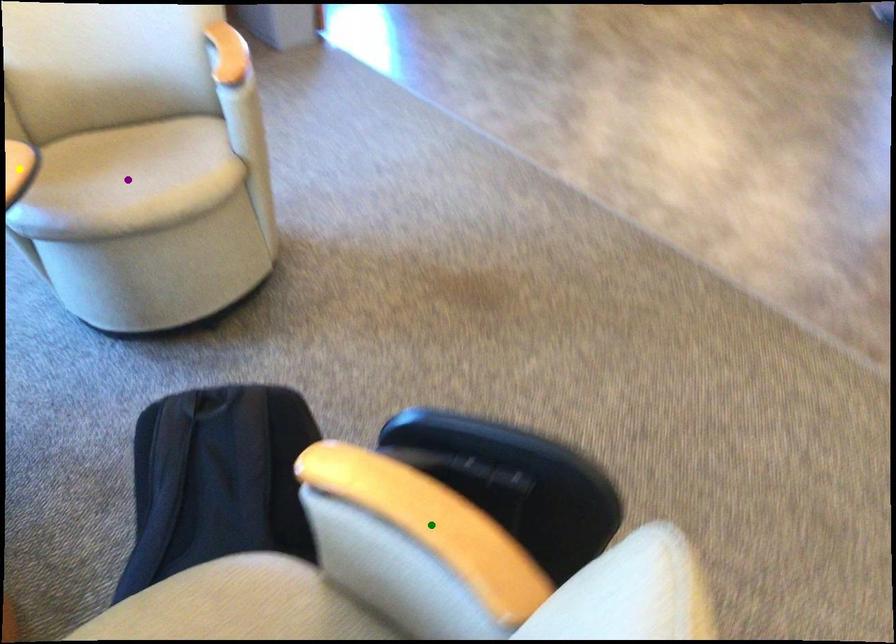
Order these from nearest to farthest:
A) green point
B) purple point
C) yellow point

green point < purple point < yellow point